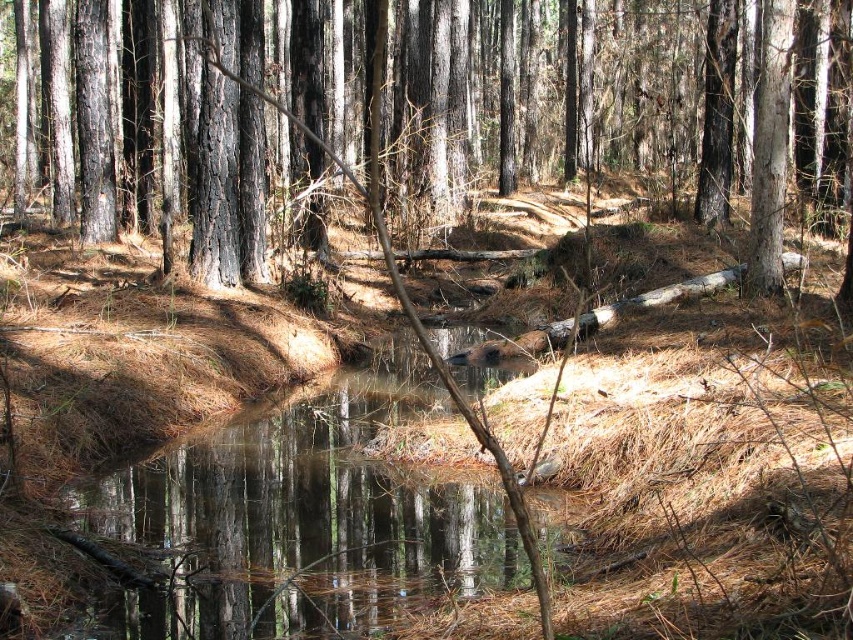
Can you confirm if smooth bark tree at center is taller than clear water at center?

Yes, smooth bark tree at center is taller than clear water at center.

How far apart are smooth bark tree at center and clear water at center?

They are 74.65 feet apart.

The image size is (853, 640). In order to click on smooth bark tree at center in this screenshot , I will do pos(573,90).